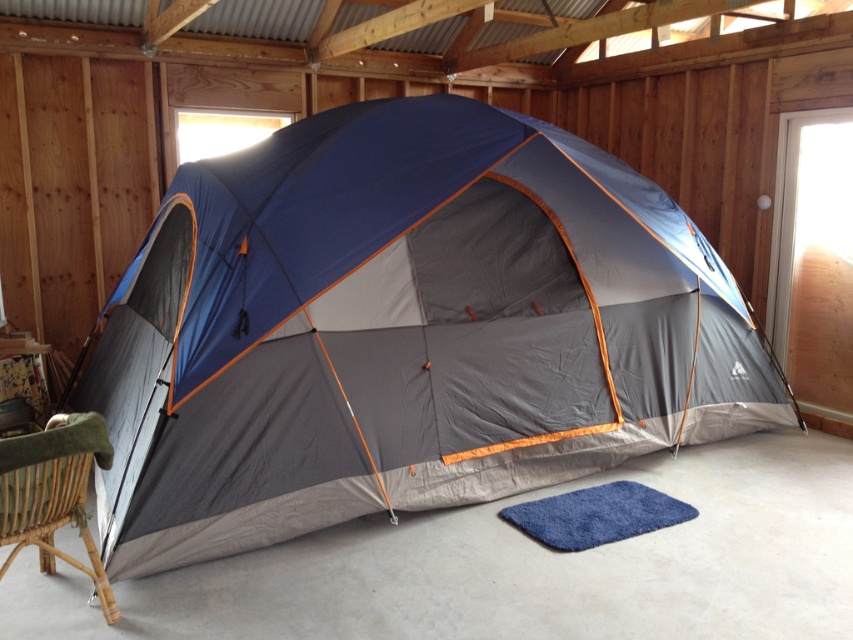
You are standing inside the wooden structure and want to locate the blue fabric tent at center. According to the coordinates provided, where should you look? Please provide the coordinates in the format of a point like point [404,330].

The blue fabric tent at center is located at point [404,330].

You are setting up a camping gear organizer that requires 4 feet of space between the blue fabric tent at center and the green woven chair at lower left. Based on the scene, will there be enough space between them?

The blue fabric tent at center and green woven chair at lower left are 3.98 feet apart, which is slightly less than the required 4 feet. Therefore, there is not enough space between them for the camping gear organizer.

You are setting up a campsite inside a wooden structure. You have a blue fabric tent at center and a green woven chair at lower left. Where should you place your sleeping bag to be closest to both the tent and the chair?

Place the sleeping bag between the blue fabric tent at center and the green woven chair at lower left since the blue fabric tent at center is to the right of green woven chair at lower left, positioning the sleeping bag in the middle would be closest to both.